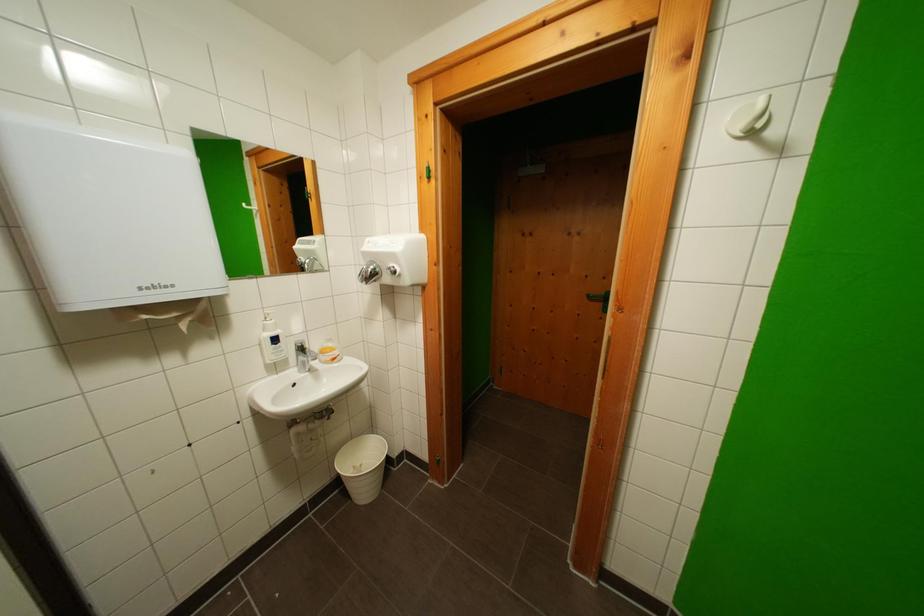
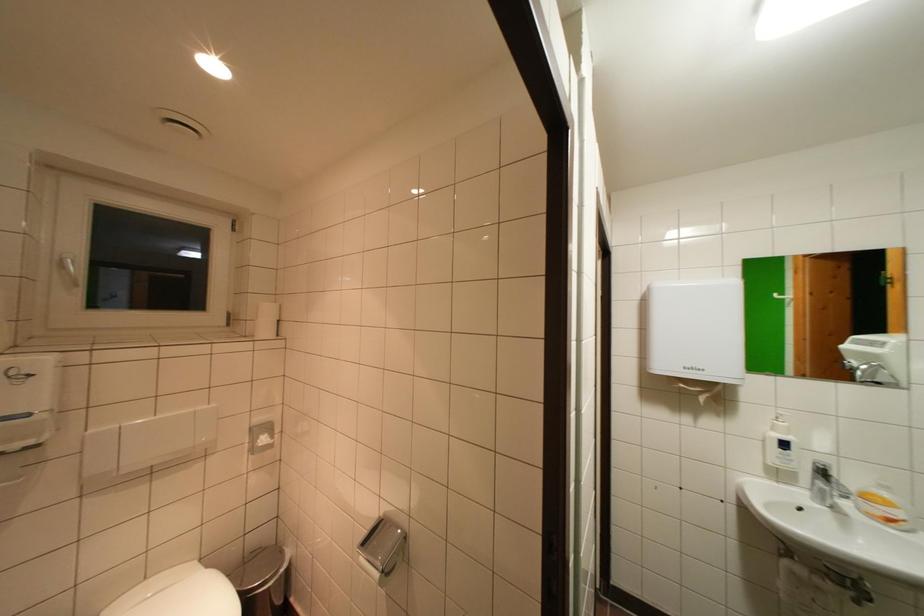
The point at (256, 208) is marked in the first image. Where is the corresponding point in the second image?

(788, 297)